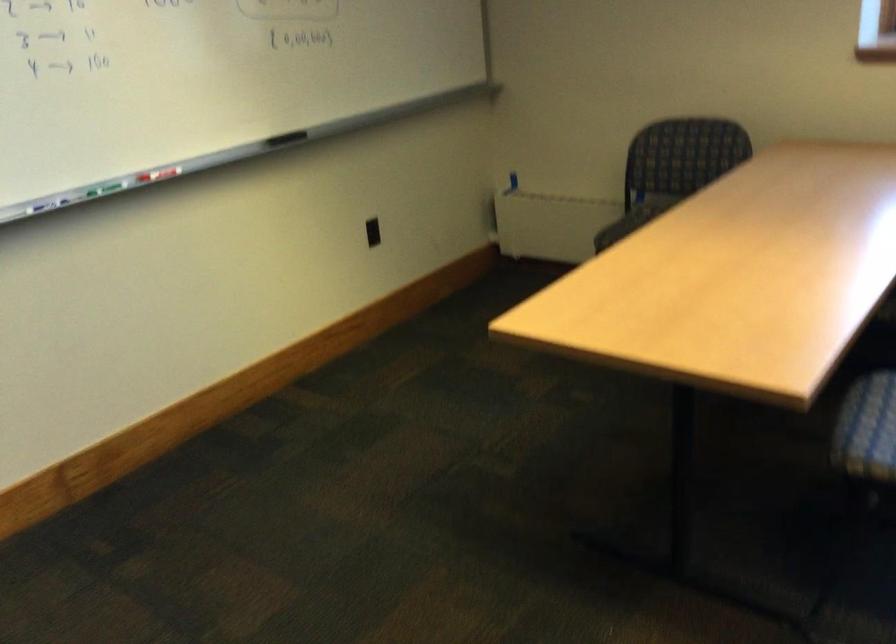
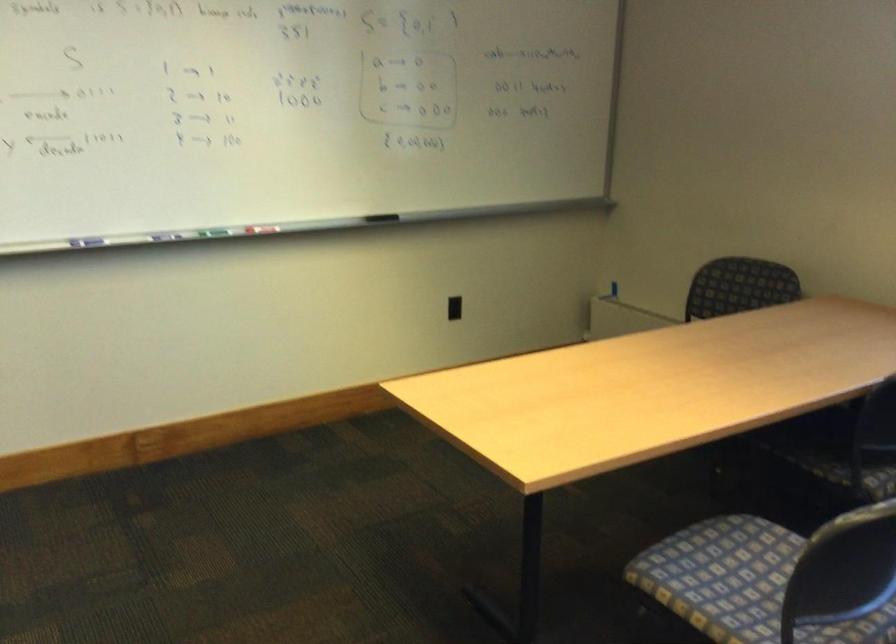
Question: Which direction would the cameraman need to move to produce the second image? Reply with the corresponding letter.

Choices:
 (A) Left
 (B) Right
 (C) Forward
 (D) Backward

Answer: (B)